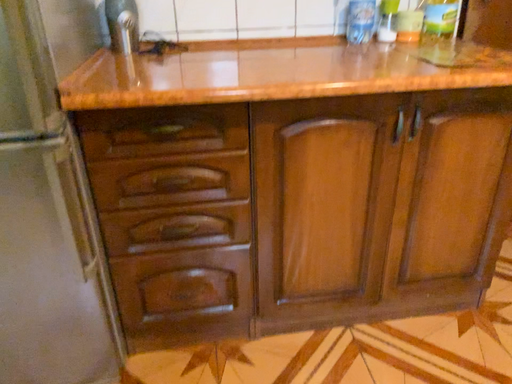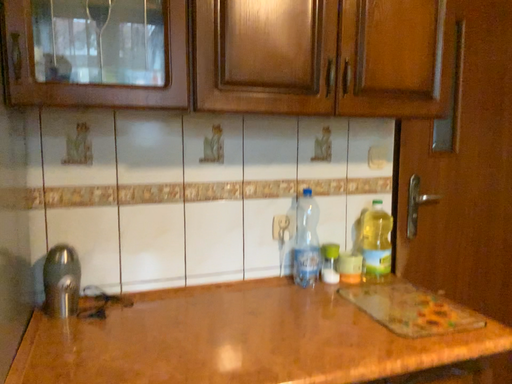
Question: Which way did the camera rotate in the video?

Choices:
 (A) rotated downward
 (B) rotated upward

Answer: (B)